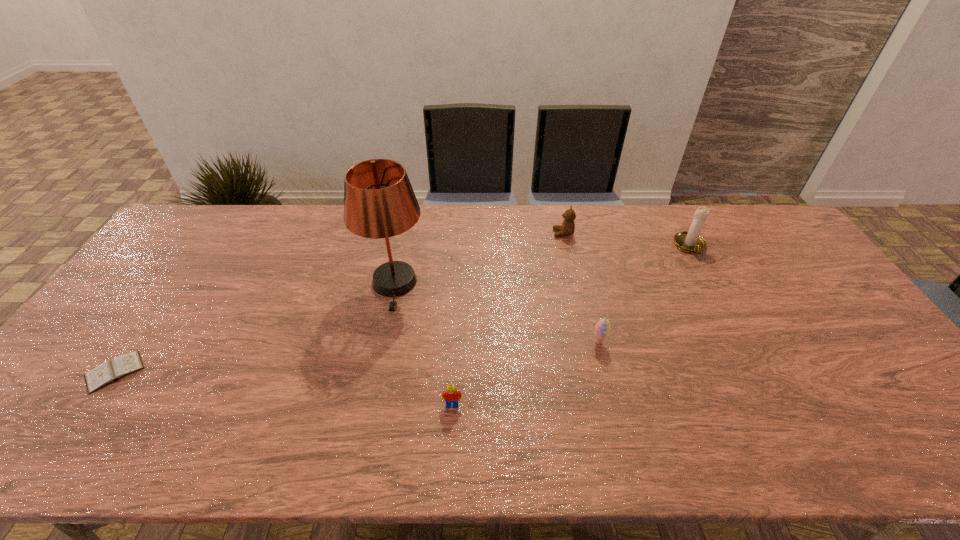
Where is `free point between the second tallest object and the third nearest object`? This screenshot has height=540, width=960. free point between the second tallest object and the third nearest object is located at coordinates (644, 294).

The image size is (960, 540). I want to click on free spot between the rightmost object and the nearest object, so click(571, 326).

Identify the location of free space between the Lego and the fourth nearest object. This screenshot has height=540, width=960. (423, 344).

Image resolution: width=960 pixels, height=540 pixels. Identify the location of free point between the second tallest object and the teddy bear. (627, 240).

Select which object appears as the fifth closest to the leftmost object. Please provide its 2D coordinates. Your answer should be formatted as a tuple, i.e. [(x, y)], where the tuple contains the x and y coordinates of a point satisfying the conditions above.

[(690, 241)]

Identify which object is located as the nearest to the leftmost object. Please provide its 2D coordinates. Your answer should be formatted as a tuple, i.e. [(x, y)], where the tuple contains the x and y coordinates of a point satisfying the conditions above.

[(379, 202)]

I want to click on vacant region that satisfies the following two spatial constraints: 1. on the front-facing side of the fourth farthest object; 2. on the right side of the tallest object, so click(382, 342).

Find the location of `free space in the image that satisfies the following two spatial constraints: 1. on the front-facing side of the teddy bear; 2. on the face of the fifth tallest object`. free space in the image that satisfies the following two spatial constraints: 1. on the front-facing side of the teddy bear; 2. on the face of the fifth tallest object is located at coordinates (600, 405).